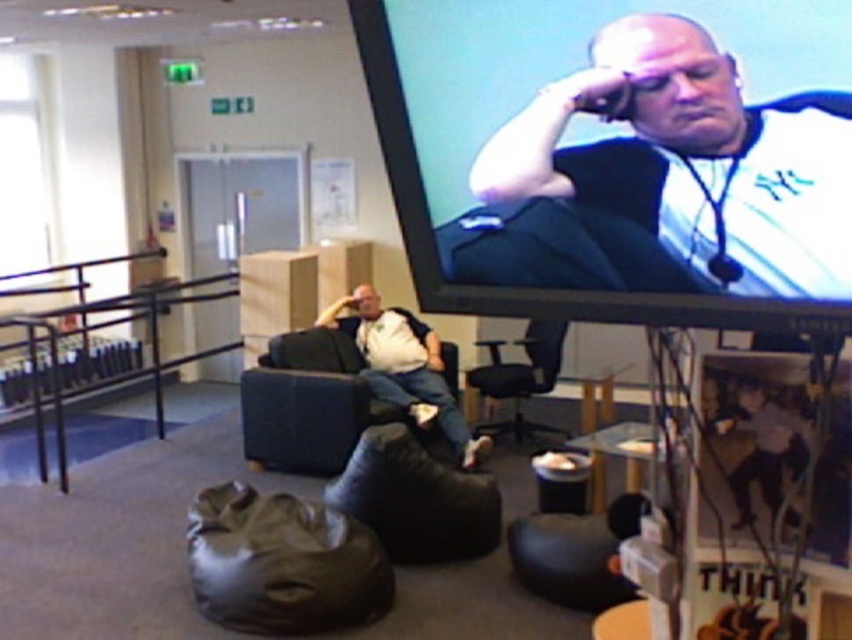
Question: Considering the real-world distances, which object is farthest from the dark brown leather bean bag at lower center?

Choices:
 (A) black fabric armchair at center
 (B) white matte shirt at center
 (C) matte black jacket at upper right

Answer: (A)

Question: In this image, where is dark brown leather bean bag at lower center located relative to white matte shirt at center?

Choices:
 (A) below
 (B) above

Answer: (A)

Question: Which of the following is the closest to the observer?

Choices:
 (A) black leather swivel chair at center
 (B) dark brown leather bean bag at lower center

Answer: (B)

Question: Does matte black jacket at upper right have a greater width compared to dark brown leather bean bag at lower center?

Choices:
 (A) yes
 (B) no

Answer: (B)

Question: Which point is closer to the camera?

Choices:
 (A) matte black jacket at upper right
 (B) white matte shirt at center
 (C) black leather swivel chair at center
 (D) black fabric armchair at center

Answer: (A)

Question: Is matte black jacket at upper right wider than dark brown leather bean bag at lower center?

Choices:
 (A) yes
 (B) no

Answer: (B)